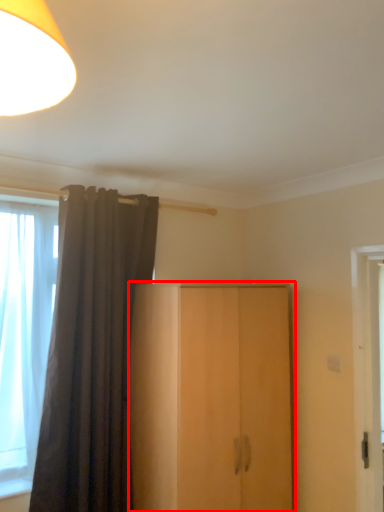
Question: Considering the relative positions of cupboard (annotated by the red box) and curtain in the image provided, where is cupboard (annotated by the red box) located with respect to the staircase?

Choices:
 (A) left
 (B) right

Answer: (B)